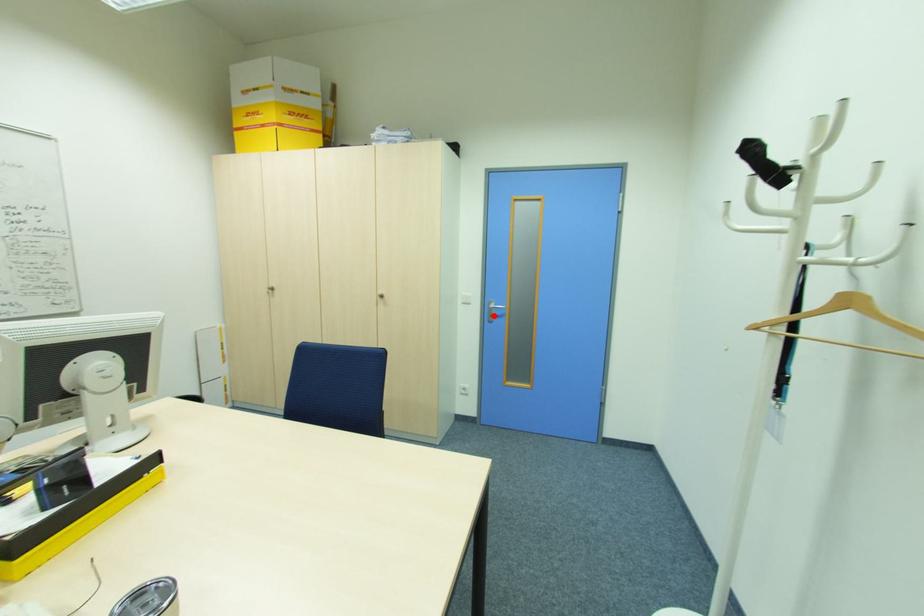
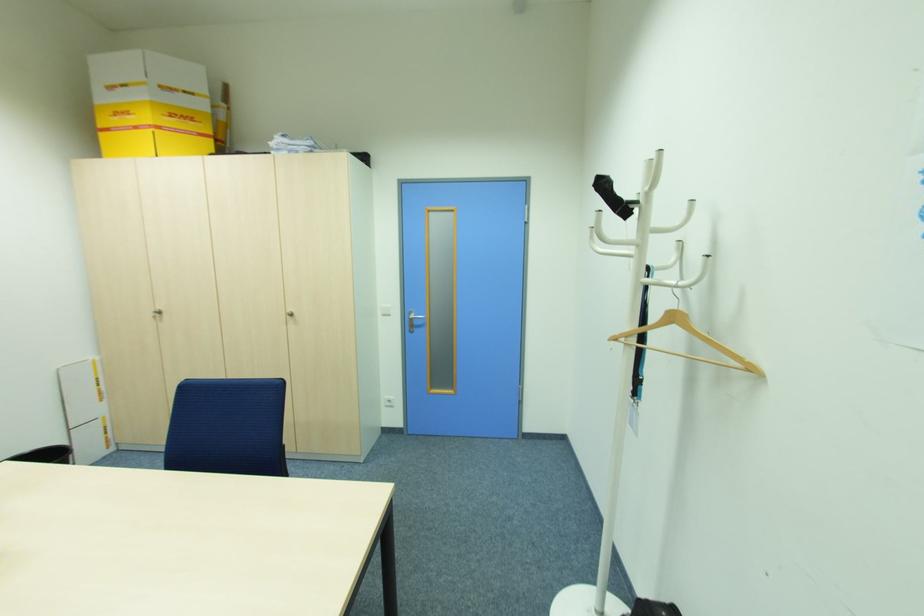
Question: I am providing you with two images of the same scene from different viewpoints. Given a red point in image1, look at the same physical point in image2. Is it:

Choices:
 (A) Closer to the viewpoint
 (B) Farther from the viewpoint

Answer: (B)